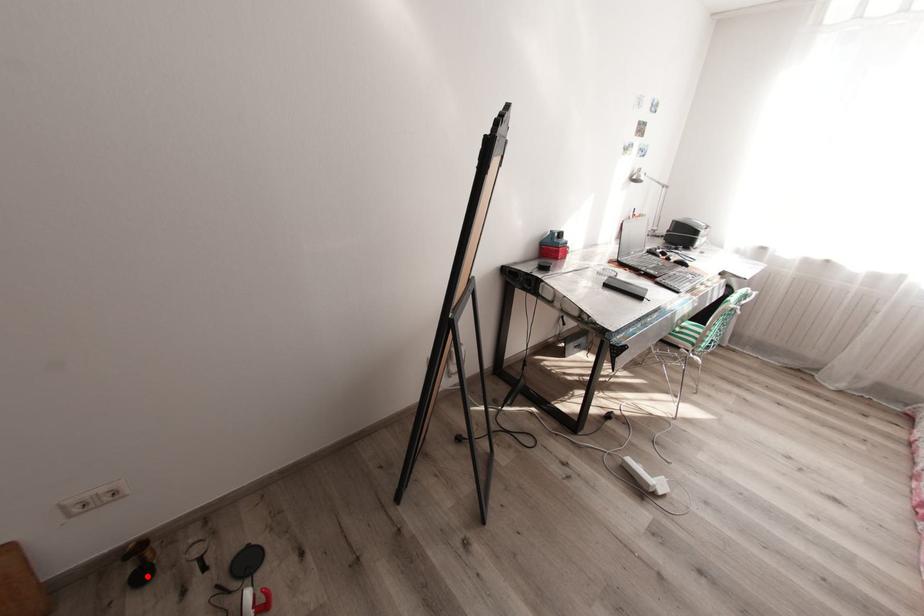
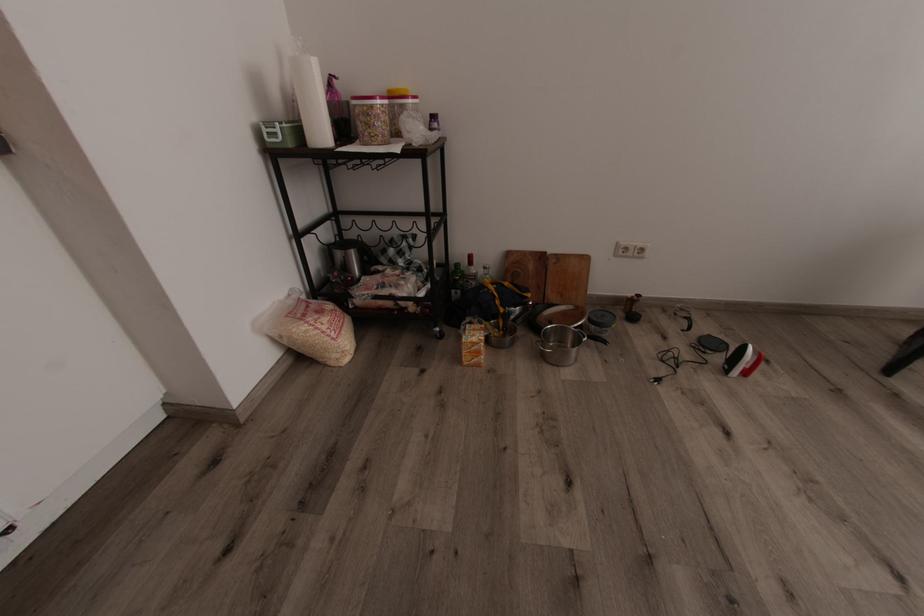
In the second image, find the point that corresponds to the highlighted location in the first image.

(638, 317)